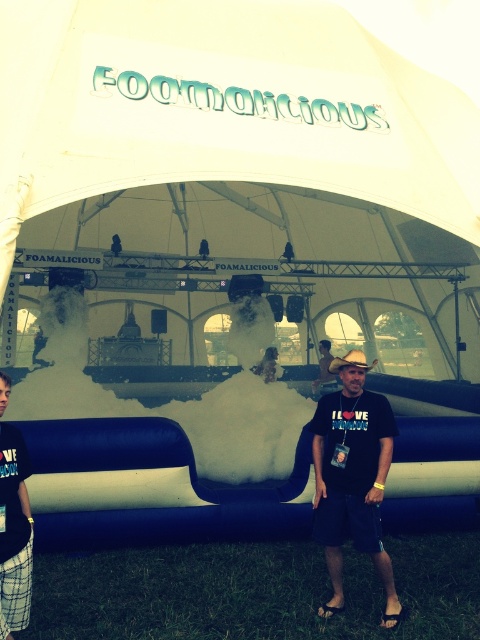
Question: Is white fluffy foam at center closer to the viewer compared to matte black cowboy hat at center?

Choices:
 (A) yes
 (B) no

Answer: (A)

Question: Is white fluffy foam at center to the right of plaid shorts at lower left from the viewer's perspective?

Choices:
 (A) no
 (B) yes

Answer: (B)

Question: Which object is the closest to the white fluffy foam at center?

Choices:
 (A) brown straw hat at center
 (B) black matte t-shirt at center

Answer: (A)

Question: Which object is the farthest from the brown straw hat at center?

Choices:
 (A) white fluffy foam at center
 (B) black matte t-shirt at center
 (C) plaid shorts at lower left
 (D) matte black cowboy hat at center

Answer: (D)

Question: Which of these objects is positioned farthest from the plaid shorts at lower left?

Choices:
 (A) matte black cowboy hat at center
 (B) brown straw hat at center
 (C) white fluffy foam at center

Answer: (A)

Question: In this image, where is black matte t-shirt at center located relative to matte black cowboy hat at center?

Choices:
 (A) below
 (B) above

Answer: (A)